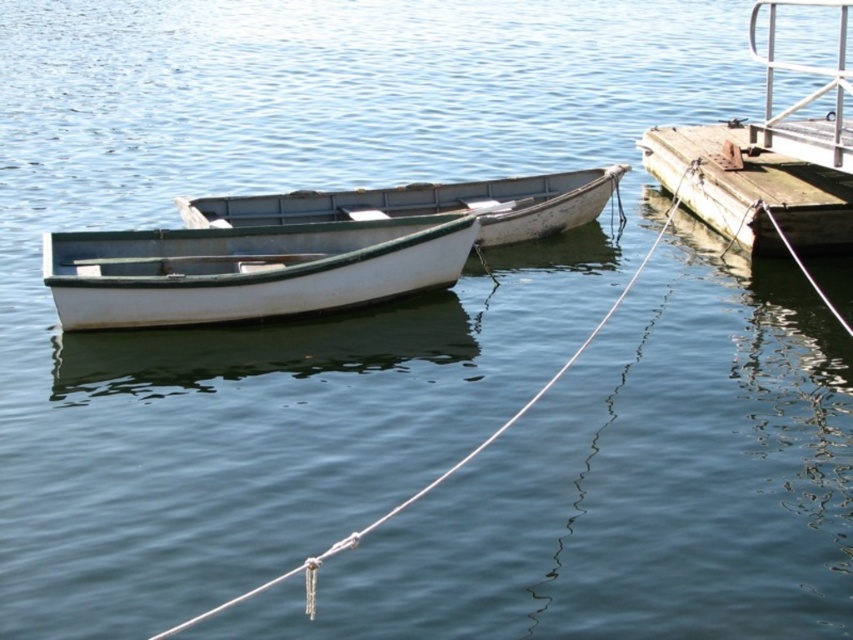
Question: Considering the relative positions of rusty wood dock at right and white painted wood boat at center in the image provided, where is rusty wood dock at right located with respect to white painted wood boat at center?

Choices:
 (A) above
 (B) below

Answer: (B)

Question: Considering the real-world distances, which object is farthest from the white matte boat at left?

Choices:
 (A) rusty wood dock at right
 (B) white painted wood boat at center

Answer: (A)

Question: Does white matte boat at left appear on the left side of rusty wood dock at right?

Choices:
 (A) yes
 (B) no

Answer: (A)

Question: Which point is closer to the camera?

Choices:
 (A) (577, 355)
 (B) (816, 216)
 (C) (512, 220)
 (D) (248, 268)

Answer: (A)

Question: Among these objects, which one is nearest to the camera?

Choices:
 (A) white rope at center
 (B) white painted wood boat at center
 (C) white matte boat at left

Answer: (A)

Question: Is rusty wood dock at right wider than white rope at center?

Choices:
 (A) no
 (B) yes

Answer: (A)